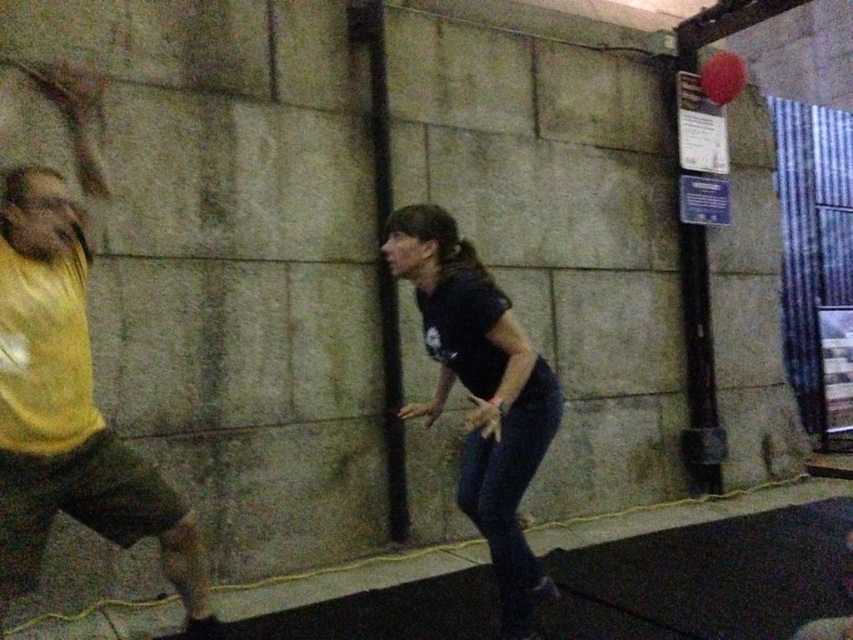
In the scene shown: You are standing at the center of the room and want to throw a ball to the yellow fabric shirt at left. In which direction should you aim?

The yellow fabric shirt at left is located at point 0.641 on the x and 0.082 on the y, so you should aim to the left side of the room.

You are a photographer trying to capture both the yellow fabric shirt at left and the black matte shirt at center in a single frame. Which person should you focus on first to ensure both are in the shot?

You should focus on the yellow fabric shirt at left first because it is in front of the black matte shirt at center, ensuring both are visible in the frame.